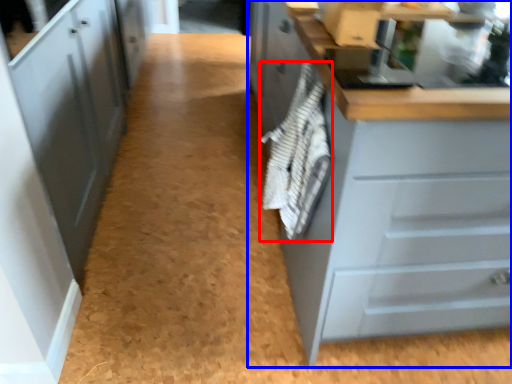
Question: Among these objects, which one is nearest to the camera, material (highlighted by a red box) or cabinetry (highlighted by a blue box)?

Choices:
 (A) material
 (B) cabinetry

Answer: (B)